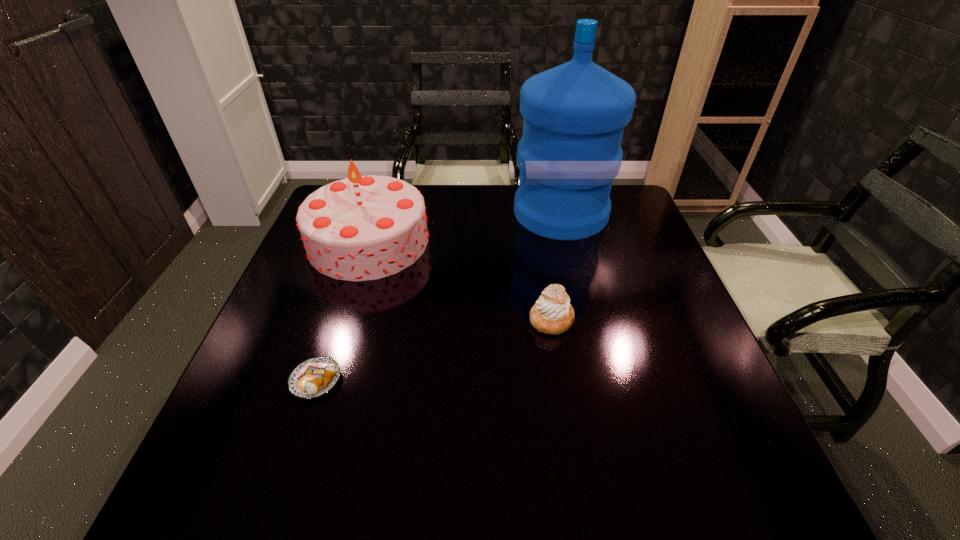
You are a GUI agent. You are given a task and a screenshot of the screen. Output one action in this format:
    pyautogui.click(x=<x>, y=<y>)
    Task: Click on the free area in between the shortest object and the water jug
    The width and height of the screenshot is (960, 540).
    Given the screenshot: What is the action you would take?
    pyautogui.click(x=438, y=297)

The width and height of the screenshot is (960, 540). Find the location of `free space between the nearer pastry and the right pastry`. free space between the nearer pastry and the right pastry is located at coordinates (434, 350).

Find the location of a particular element. object identified as the second closest to the third farthest object is located at coordinates (360, 228).

What are the coordinates of `object that stands as the closest to the tallest object` in the screenshot? It's located at (360, 228).

This screenshot has height=540, width=960. I want to click on vacant space that satisfies the following two spatial constraints: 1. on the back side of the birthday cake; 2. on the right side of the nearest object, so click(x=361, y=241).

I want to click on vacant point that satisfies the following two spatial constraints: 1. on the back side of the third tallest object; 2. on the left side of the nearest object, so click(x=336, y=319).

Find the location of a particular element. This screenshot has height=540, width=960. free spot that satisfies the following two spatial constraints: 1. on the back side of the second shortest object; 2. on the right side of the left pastry is located at coordinates (336, 319).